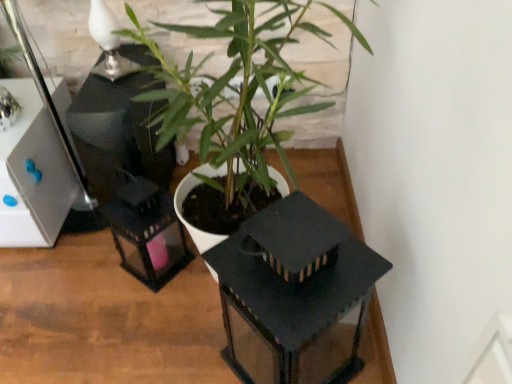
Question: Considering the positions of matte black lantern at center and green matte plant at center in the image, is matte black lantern at center wider or thinner than green matte plant at center?

Choices:
 (A) thin
 (B) wide

Answer: (B)

Question: From the image's perspective, relative to green matte plant at center, is matte black lantern at center above or below?

Choices:
 (A) below
 (B) above

Answer: (A)

Question: Which of these objects is positioned farthest from the green matte plant at center?

Choices:
 (A) white glossy table lamp at upper left
 (B) matte black lantern at center

Answer: (B)

Question: Which is nearer to the green matte plant at center?

Choices:
 (A) matte black lantern at center
 (B) white glossy table lamp at upper left

Answer: (B)